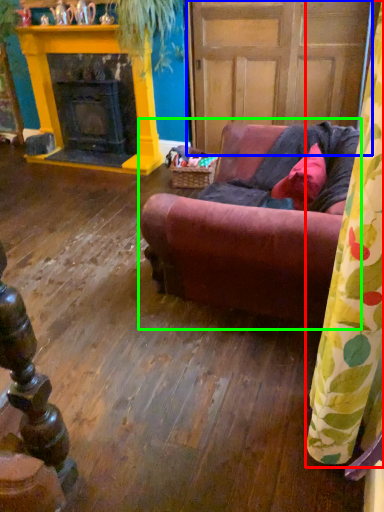
Question: Based on their relative distances, which object is nearer to curtain (highlighted by a red box)? Choose from door (highlighted by a blue box) and studio couch (highlighted by a green box).

Choices:
 (A) door
 (B) studio couch

Answer: (B)